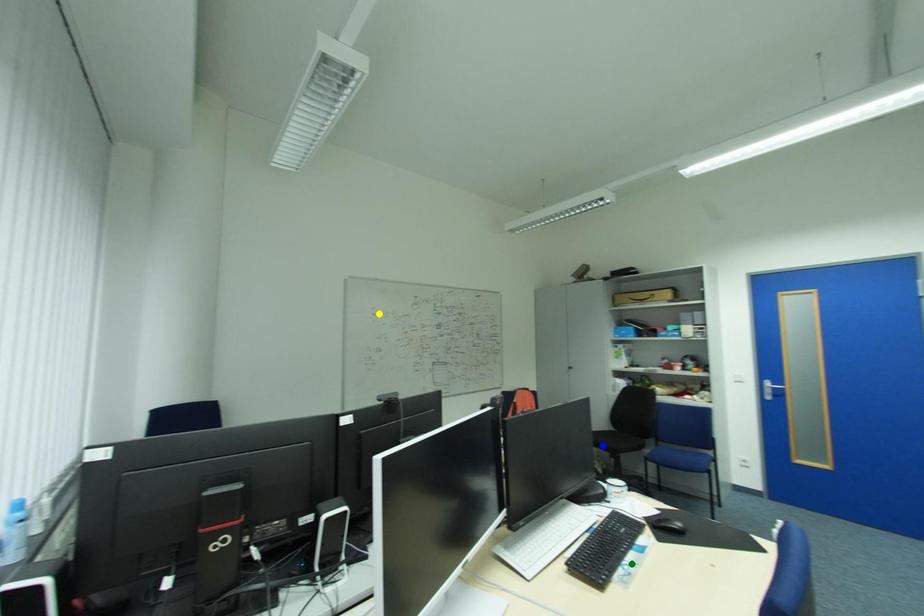
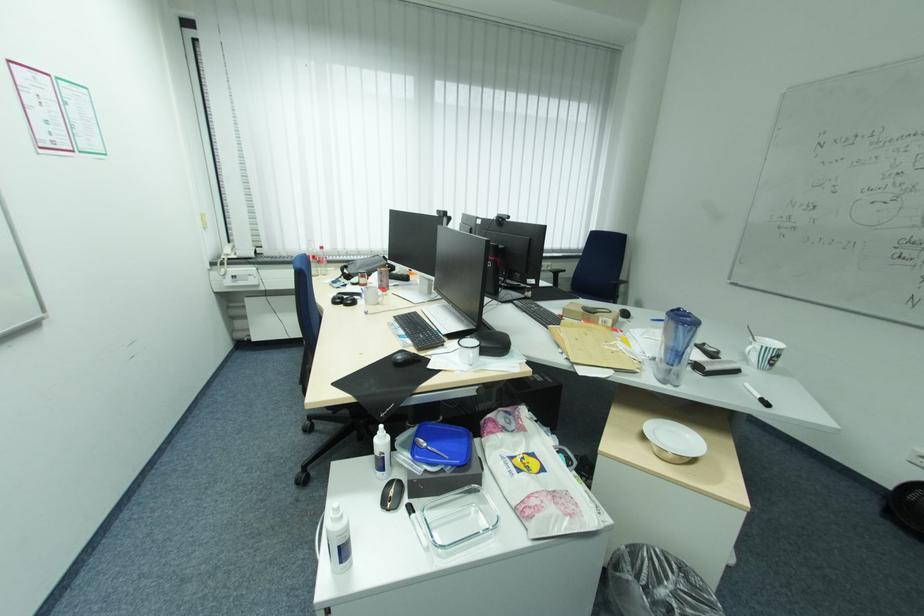
I am providing you with two images of the same scene from different viewpoints. Three points are marked in image1. Which point corresponds to a part or object that is occluded in image2?In image1, three points are marked. Which of them correspond to a part or object that is occluded in image2?Among the three points shown in image1, which one corresponds to a part or object that is no longer visible due to occlusion in image2?

Invisible in image2: blue point.